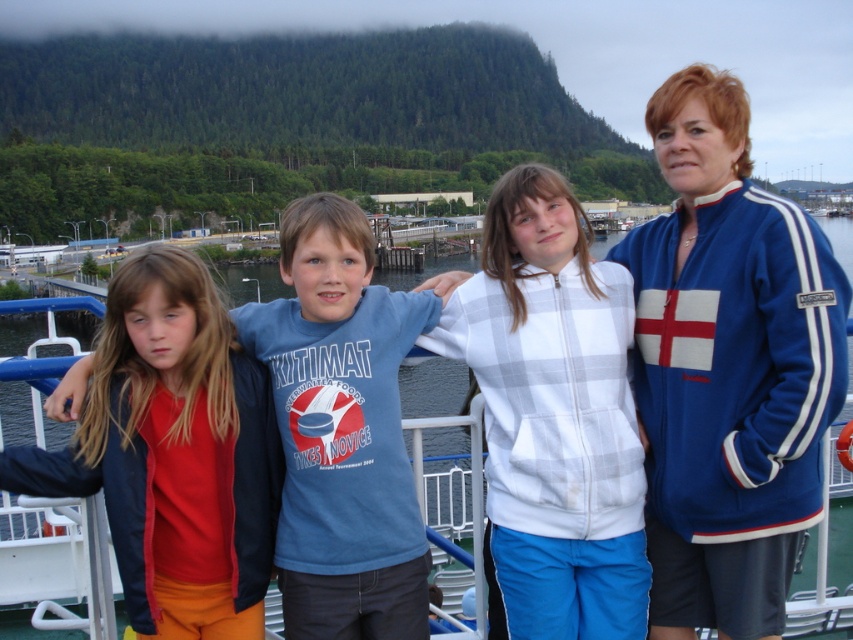
You are a photographer trying to capture a photo of the matte red shirt at left and the blue fabric boat at center. Which object should you focus on first if you want to ensure both are in focus without adjusting the camera settings?

The matte red shirt at left is shorter than the blue fabric boat at center, so focusing on the blue fabric boat at center first will help ensure both are in focus since it is farther away.